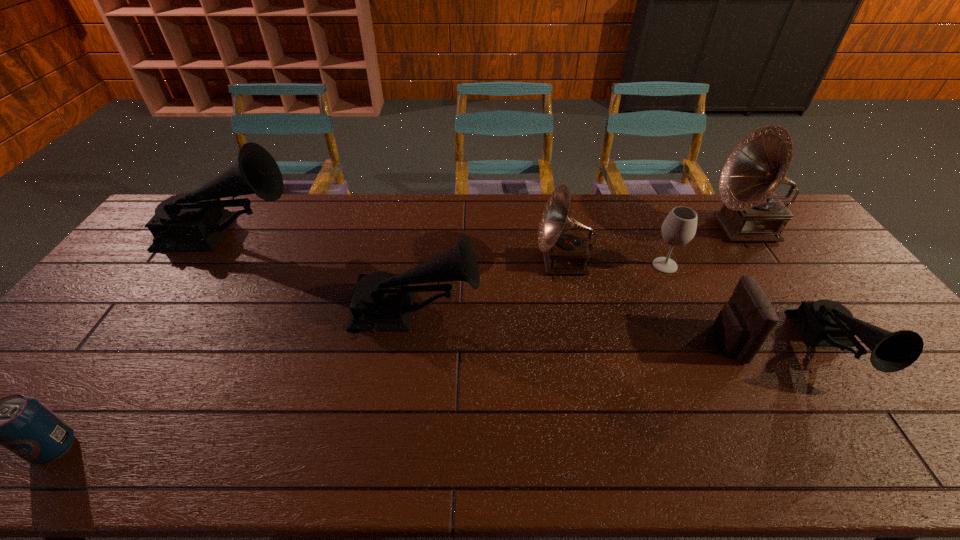
Identify the location of object positioned at the far left corner. (195, 221).

Identify the location of object positioned at the near left corner. (23, 425).

In order to click on object that is at the far right corner in this screenshot , I will do `click(752, 212)`.

Find the location of a particular element. Image resolution: width=960 pixels, height=540 pixels. vacant space at the far edge of the desktop is located at coordinates (365, 197).

Where is `free point at the near edge`? Image resolution: width=960 pixels, height=540 pixels. free point at the near edge is located at coordinates (212, 458).

This screenshot has width=960, height=540. In the image, there is a desktop. In order to click on vacant space at the left edge in this screenshot , I will do `click(150, 267)`.

In order to click on free point at the right edge in this screenshot , I will do `click(769, 243)`.

I want to click on vacant space at the far right corner of the desktop, so click(x=789, y=226).

The image size is (960, 540). I want to click on free spot between the shortest object and the smallest black phonograph_record, so click(443, 398).

The height and width of the screenshot is (540, 960). What are the coordinates of `vacant area that lies between the rightmost black phonograph_record and the right brown phonograph record` in the screenshot? It's located at (788, 289).